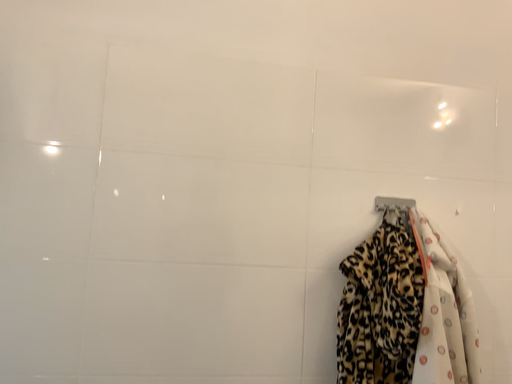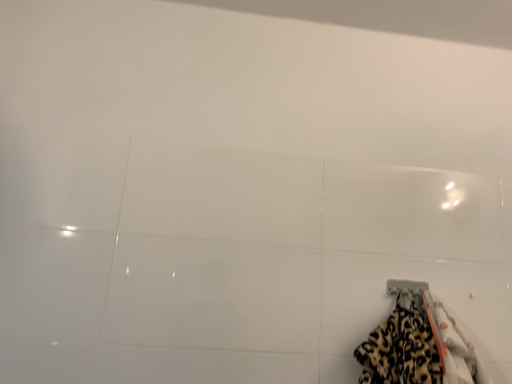
Question: How did the camera likely rotate when shooting the video?

Choices:
 (A) rotated upward
 (B) rotated downward

Answer: (A)